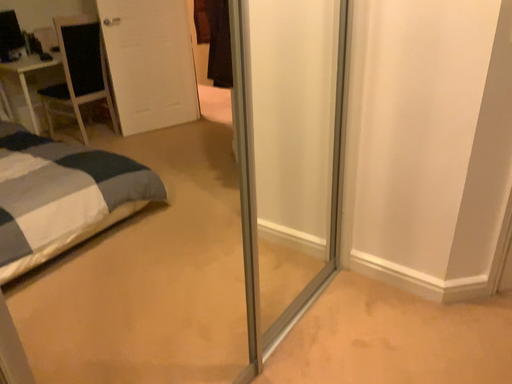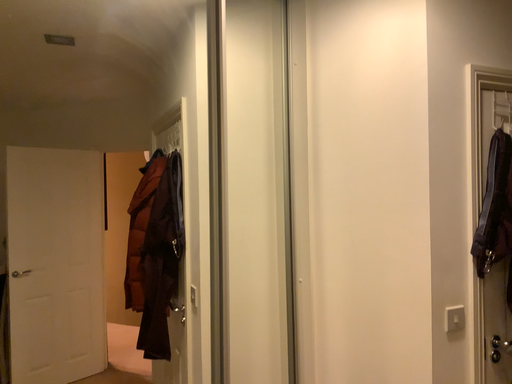
Question: Which way did the camera rotate in the video?

Choices:
 (A) rotated upward
 (B) rotated downward

Answer: (A)